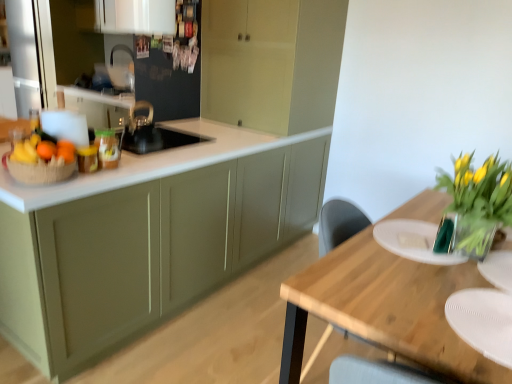
Question: Would you say translucent glass vase at right is outside white glossy cabinet at upper center, the 1th cabinetry viewed from the back?

Choices:
 (A) no
 (B) yes

Answer: (B)

Question: Is translucent glass vase at right placed right next to white glossy cabinet at upper center, the 1th cabinetry viewed from the back?

Choices:
 (A) no
 (B) yes

Answer: (A)

Question: From a real-world perspective, is translucent glass vase at right beneath white glossy cabinet at upper center, the 1th cabinetry viewed from the back?

Choices:
 (A) yes
 (B) no

Answer: (A)

Question: Is the position of translucent glass vase at right less distant than that of white glossy cabinet at upper center, placed as the fourth cabinetry when sorted from front to back?

Choices:
 (A) yes
 (B) no

Answer: (A)

Question: From the image's perspective, is translucent glass vase at right beneath white glossy cabinet at upper center, placed as the fourth cabinetry when sorted from front to back?

Choices:
 (A) no
 (B) yes

Answer: (B)

Question: From a real-world perspective, is wooden table at center above or below white matte plate at right, which ranks as the first plate in top-to-bottom order?

Choices:
 (A) below
 (B) above

Answer: (A)

Question: Is point (416, 195) closer or farther from the camera than point (393, 221)?

Choices:
 (A) farther
 (B) closer

Answer: (A)

Question: From the image's perspective, is wooden table at center located above or below white matte plate at right, the 2th plate when ordered from front to back?

Choices:
 (A) below
 (B) above

Answer: (A)

Question: Would you say wooden table at center is to the left or to the right of white matte plate at right, the 2th plate when ordered from front to back, in the picture?

Choices:
 (A) left
 (B) right

Answer: (B)

Question: Does point (457, 160) appear closer or farther from the camera than point (461, 317)?

Choices:
 (A) farther
 (B) closer

Answer: (A)

Question: Do you think translucent glass vase at right is within white matte plate at lower right, the first plate when ordered from bottom to top, or outside of it?

Choices:
 (A) inside
 (B) outside

Answer: (B)

Question: From the image's perspective, is translucent glass vase at right positioned above or below white matte plate at lower right, arranged as the 2th plate when viewed from the top?

Choices:
 (A) above
 (B) below

Answer: (A)

Question: Is translucent glass vase at right in front of or behind white matte plate at lower right, marked as the 2th plate in a back-to-front arrangement, in the image?

Choices:
 (A) behind
 (B) front

Answer: (A)

Question: Considering the positions of brown woven basket at left and white matte plate at right, the first plate when ordered from back to front, in the image, is brown woven basket at left wider or thinner than white matte plate at right, the first plate when ordered from back to front,?

Choices:
 (A) wide
 (B) thin

Answer: (B)

Question: From their relative heights in the image, would you say brown woven basket at left is taller or shorter than white matte plate at right, the first plate when ordered from back to front?

Choices:
 (A) short
 (B) tall

Answer: (B)